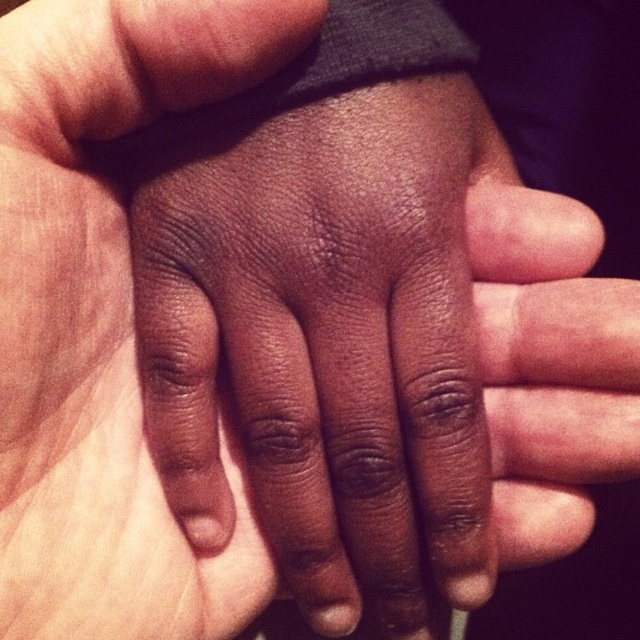
Consider the image. Can you confirm if dry skin at center is positioned to the right of dark skin palm at center?

Yes, dry skin at center is to the right of dark skin palm at center.

The image size is (640, 640). What do you see at coordinates (326, 344) in the screenshot?
I see `dry skin at center` at bounding box center [326, 344].

In order to click on dry skin at center in this screenshot , I will do `click(326, 344)`.

Image resolution: width=640 pixels, height=640 pixels. I want to click on dry skin at center, so click(326, 344).